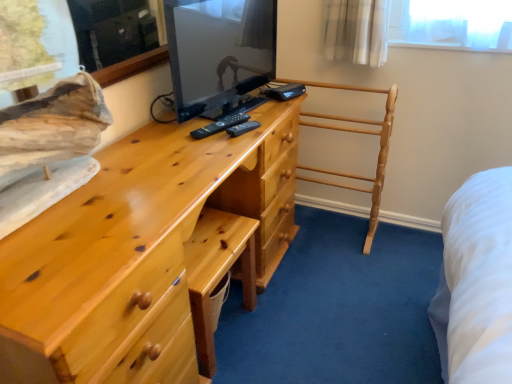
This screenshot has width=512, height=384. I want to click on vacant area situated below matte black tv at center (from a real-world perspective), so click(x=228, y=96).